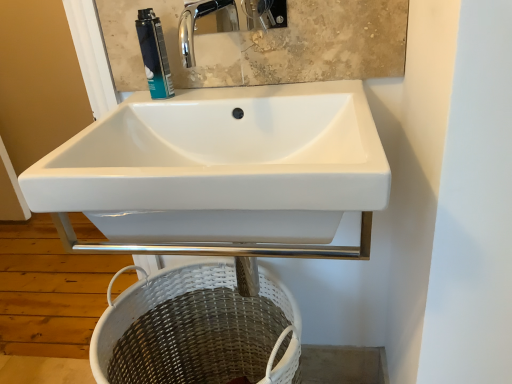
Question: Do you think white glossy sink at center is within white wicker basket at lower center, or outside of it?

Choices:
 (A) outside
 (B) inside

Answer: (A)

Question: In the image, is white glossy sink at center on the left side or the right side of white wicker basket at lower center?

Choices:
 (A) left
 (B) right

Answer: (B)

Question: Which is nearer to the blue metallic can at upper center?

Choices:
 (A) white wicker basket at lower center
 (B) white glossy sink at center

Answer: (B)

Question: Considering the real-world distances, which object is farthest from the white glossy sink at center?

Choices:
 (A) white wicker basket at lower center
 (B) blue metallic can at upper center

Answer: (A)